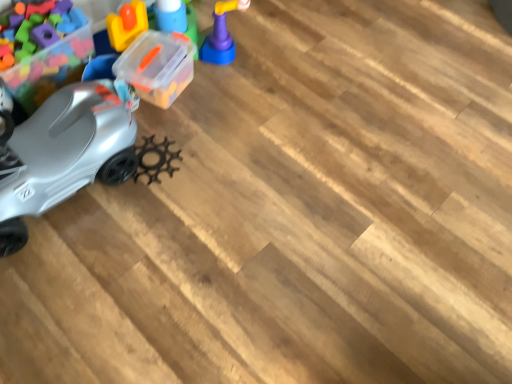
Question: Does metallic plastic car at left, acting as the 3th toy starting from the right, contain matte purple toy at upper center, which appears as the 3th toy when viewed from the left?

Choices:
 (A) yes
 (B) no

Answer: (B)

Question: Does metallic plastic car at left, the first toy when ordered from left to right, have a greater height compared to matte purple toy at upper center, which appears as the 1th toy when viewed from the right?

Choices:
 (A) yes
 (B) no

Answer: (A)

Question: From a real-world perspective, is metallic plastic car at left, acting as the 3th toy starting from the right, on top of matte purple toy at upper center, which appears as the 1th toy when viewed from the right?

Choices:
 (A) yes
 (B) no

Answer: (A)

Question: Is metallic plastic car at left, the first toy when ordered from left to right, to the left of matte purple toy at upper center, which appears as the 3th toy when viewed from the left, from the viewer's perspective?

Choices:
 (A) yes
 (B) no

Answer: (A)

Question: Is metallic plastic car at left, acting as the 3th toy starting from the right, not within matte purple toy at upper center, which appears as the 3th toy when viewed from the left?

Choices:
 (A) no
 (B) yes

Answer: (B)

Question: From a real-world perspective, relative to silver matte car at left, the second toy when ordered from right to left, is matte purple toy at upper center, which appears as the 1th toy when viewed from the right, vertically above or below?

Choices:
 (A) above
 (B) below

Answer: (B)

Question: Is matte purple toy at upper center, which appears as the 1th toy when viewed from the right, taller or shorter than silver matte car at left, the 2th toy positioned from the left?

Choices:
 (A) tall
 (B) short

Answer: (B)

Question: Based on their positions, is matte purple toy at upper center, which appears as the 3th toy when viewed from the left, located to the left or right of silver matte car at left, the 2th toy positioned from the left?

Choices:
 (A) left
 (B) right

Answer: (B)

Question: Considering the positions of matte purple toy at upper center, which appears as the 3th toy when viewed from the left, and silver matte car at left, the second toy when ordered from right to left, in the image, is matte purple toy at upper center, which appears as the 3th toy when viewed from the left, wider or thinner than silver matte car at left, the second toy when ordered from right to left,?

Choices:
 (A) thin
 (B) wide

Answer: (A)

Question: Considering the positions of point (224, 11) and point (18, 82), is point (224, 11) closer or farther from the camera than point (18, 82)?

Choices:
 (A) closer
 (B) farther

Answer: (B)

Question: Looking at their shapes, would you say matte purple toy at upper center, which appears as the 1th toy when viewed from the right, is wider or thinner than metallic plastic car at left, acting as the 3th toy starting from the right?

Choices:
 (A) thin
 (B) wide

Answer: (A)

Question: Which is correct: matte purple toy at upper center, which appears as the 1th toy when viewed from the right, is inside metallic plastic car at left, acting as the 3th toy starting from the right, or outside of it?

Choices:
 (A) inside
 (B) outside

Answer: (B)

Question: From the image's perspective, relative to metallic plastic car at left, the first toy when ordered from left to right, is matte purple toy at upper center, which appears as the 3th toy when viewed from the left, above or below?

Choices:
 (A) above
 (B) below

Answer: (A)

Question: Considering the positions of point (26, 79) and point (72, 134), is point (26, 79) closer or farther from the camera than point (72, 134)?

Choices:
 (A) closer
 (B) farther

Answer: (B)

Question: Based on their sizes in the image, would you say metallic plastic car at left, acting as the 3th toy starting from the right, is bigger or smaller than silver matte car at left, the second toy when ordered from right to left?

Choices:
 (A) big
 (B) small

Answer: (B)